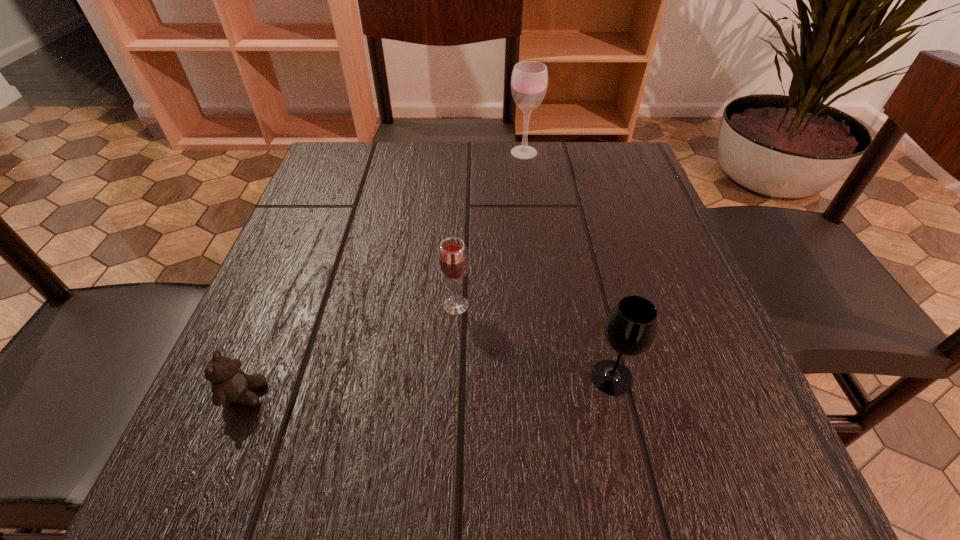
Where is `unoccupied position between the second farthest wineglass and the second wineglass from left to right`? This screenshot has width=960, height=540. unoccupied position between the second farthest wineglass and the second wineglass from left to right is located at coordinates (490, 229).

You are a GUI agent. You are given a task and a screenshot of the screen. Output one action in this format:
    pyautogui.click(x=<x>, y=<y>)
    Task: Click on the second closest object relative to the second wineglass from left to right
    
    Given the screenshot: What is the action you would take?
    630,329

This screenshot has height=540, width=960. In order to click on object that stands as the second closest to the second nearest wineglass in this screenshot , I will do `click(230, 384)`.

This screenshot has width=960, height=540. I want to click on the third closest wineglass to the shortest object, so click(x=529, y=80).

Identify which wineglass is the third nearest to the leftmost object. Please provide its 2D coordinates. Your answer should be formatted as a tuple, i.e. [(x, y)], where the tuple contains the x and y coordinates of a point satisfying the conditions above.

[(529, 80)]

At what (x,y) coordinates should I click in order to perform the action: click on vacant space that satisfies the following two spatial constraints: 1. on the front side of the farthest wineglass; 2. on the face of the shortest object. Please return your answer as a coordinate pair (x, y). Looking at the image, I should click on (556, 394).

Where is `vacant area that satisfies the following two spatial constraints: 1. on the front side of the second object from right to left; 2. on the left side of the rightmost wineglass`? This screenshot has width=960, height=540. vacant area that satisfies the following two spatial constraints: 1. on the front side of the second object from right to left; 2. on the left side of the rightmost wineglass is located at coordinates (554, 377).

This screenshot has width=960, height=540. In order to click on free region that satisfies the following two spatial constraints: 1. on the front side of the second object from left to right; 2. on the right side of the rightmost object in this screenshot , I will do `click(452, 377)`.